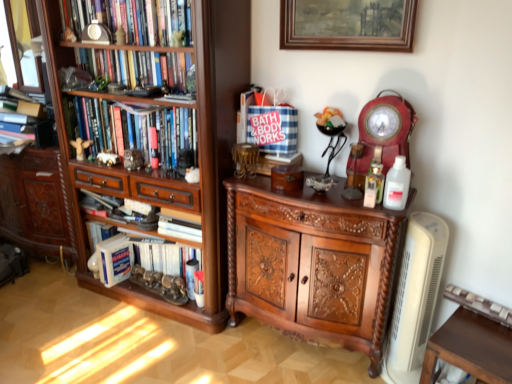
Find the location of `white plastic bottle at right`. white plastic bottle at right is located at coordinates pos(397,185).

Describe the element at coordinates (108, 158) in the screenshot. I see `gold metallic toy car at left, marked as the second toy in a left-to-right arrangement` at that location.

Describe the element at coordinates (20, 44) in the screenshot. I see `transparent glass door at upper left` at that location.

Looking at this image, in order to face matte white clock at upper left, which is the 4th book in bottom-to-top order, should I rotate leftwards or rightwards?

To face it directly, rotate left by 15.311 degrees.

In order to click on brown wooden table at lower right in this screenshot , I will do `click(471, 348)`.

I want to click on white plastic bottle at right, so click(397, 185).

Is matte white clock at upper left, marked as the 1th book in a top-to-bottom arrangement, oriented towards transparent glass door at upper left?

No, matte white clock at upper left, marked as the 1th book in a top-to-bottom arrangement, does not turn towards transparent glass door at upper left.

Considering the sizes of objects matte white clock at upper left, marked as the 1th book in a top-to-bottom arrangement, and transparent glass door at upper left in the image provided, who is bigger, matte white clock at upper left, marked as the 1th book in a top-to-bottom arrangement, or transparent glass door at upper left?

matte white clock at upper left, marked as the 1th book in a top-to-bottom arrangement, is bigger.

This screenshot has width=512, height=384. What are the coordinates of `glass door located on the left of matte white clock at upper left, which is the 4th book in bottom-to-top order` in the screenshot? It's located at (20, 44).

Is matte white clock at upper left, which is the 4th book in bottom-to-top order, situated inside transparent glass door at upper left or outside?

matte white clock at upper left, which is the 4th book in bottom-to-top order, is outside transparent glass door at upper left.

From a real-world perspective, which is physically above, white plastic bottle at right or polished wood cabinet at center?

white plastic bottle at right.

Looking at this image, between white plastic bottle at right and polished wood cabinet at center, which one has more height?

polished wood cabinet at center is taller.

Would you say white plastic bottle at right is a long distance from polished wood cabinet at center?

They are positioned close to each other.

Is white plastic bottle at right oriented towards polished wood cabinet at center?

No, white plastic bottle at right is not oriented towards polished wood cabinet at center.

Does brown wooden table at lower right have a larger size compared to hardcover book at lower left?

Yes.

Can you confirm if brown wooden table at lower right is wider than hardcover book at lower left?

Correct, the width of brown wooden table at lower right exceeds that of hardcover book at lower left.

Between brown wooden table at lower right and hardcover book at lower left, which one appears on the right side from the viewer's perspective?

Positioned to the right is brown wooden table at lower right.

Relative to hardcover book at lower left, is brown wooden table at lower right in front or behind?

brown wooden table at lower right is in front of hardcover book at lower left.

From the image's perspective, is wooden bookshelf at left beneath brown wooden table at lower right?

Incorrect, from the image's perspective, wooden bookshelf at left is higher than brown wooden table at lower right.

Is wooden bookshelf at left aimed at brown wooden table at lower right?

No.

Is point (71, 179) closer or farther from the camera than point (488, 345)?

Point (71, 179) is farther from the camera than point (488, 345).

Can you confirm if transparent glass door at upper left is positioned to the right of hardcover books at left, which is counted as the second book, starting from the bottom?

No.

Does transparent glass door at upper left have a lesser width compared to hardcover books at left, which is counted as the second book, starting from the bottom?

Yes.

From the picture: Does transparent glass door at upper left have a larger size compared to hardcover books at left, which ranks as the 3th book in top-to-bottom order?

No.

Is matte gold angel at left, the 1th toy viewed from the left, positioned in front of hardcover book at lower left, the 1th book ordered from the bottom?

No, it is not.

Can hardcover book at lower left, the 1th book ordered from the bottom, be found inside matte gold angel at left, the 1th toy viewed from the left?

No, hardcover book at lower left, the 1th book ordered from the bottom, is not inside matte gold angel at left, the 1th toy viewed from the left.

From a real-world perspective, between matte gold angel at left, the 1th toy viewed from the left, and hardcover book at lower left, the fourth book viewed from the top, who is vertically lower?

hardcover book at lower left, the fourth book viewed from the top, from a real-world perspective.

Would you say matte gold angel at left, the 1th toy viewed from the left, is to the left or to the right of hardcover book at lower left, the fourth book viewed from the top, in the picture?

From the image, it's evident that matte gold angel at left, the 1th toy viewed from the left, is to the left of hardcover book at lower left, the fourth book viewed from the top.

In the scene shown: From the image's perspective, which is above, brown wooden table at lower right or gold metallic toy car at left, the 1th toy when ordered from right to left?

gold metallic toy car at left, the 1th toy when ordered from right to left.

Based on their sizes in the image, would you say brown wooden table at lower right is bigger or smaller than gold metallic toy car at left, the 1th toy when ordered from right to left?

Considering their sizes, brown wooden table at lower right takes up more space than gold metallic toy car at left, the 1th toy when ordered from right to left.

Considering the sizes of brown wooden table at lower right and gold metallic toy car at left, the 1th toy when ordered from right to left, in the image, is brown wooden table at lower right wider or thinner than gold metallic toy car at left, the 1th toy when ordered from right to left,?

In the image, brown wooden table at lower right appears to be wider than gold metallic toy car at left, the 1th toy when ordered from right to left.

Are brown wooden table at lower right and gold metallic toy car at left, marked as the second toy in a left-to-right arrangement, making contact?

No, brown wooden table at lower right is not next to gold metallic toy car at left, marked as the second toy in a left-to-right arrangement.

The height and width of the screenshot is (384, 512). There is a transparent glass door at upper left. Find the location of `the 1st book below it (from the image's perspective)`. the 1st book below it (from the image's perspective) is located at coordinates (133, 19).

Where is `the chest of drawers that appears behind the white plastic bottle at right`? the chest of drawers that appears behind the white plastic bottle at right is located at coordinates (312, 263).

Based on their spatial positions, is hardcover book at lower left or wooden picture frame at upper center further from matte white clock at upper left, marked as the 1th book in a top-to-bottom arrangement?

hardcover book at lower left is positioned further to the anchor matte white clock at upper left, marked as the 1th book in a top-to-bottom arrangement.

Looking at the image, which one is located further to wooden carved cabinet at left, white plastic bottle at right or matte white clock at upper left, marked as the 1th book in a top-to-bottom arrangement?

white plastic bottle at right is further to wooden carved cabinet at left.

From the picture: Looking at the image, which one is located further to gold metallic toy car at left, marked as the second toy in a left-to-right arrangement, hardcover book at lower left or wooden picture frame at upper center?

The object further to gold metallic toy car at left, marked as the second toy in a left-to-right arrangement, is wooden picture frame at upper center.

When comparing their distances from wooden carved cabinet at left, does wooden picture frame at upper center or hardcover books at left, which is counted as the second book, starting from the bottom, seem closer?

hardcover books at left, which is counted as the second book, starting from the bottom, lies closer to wooden carved cabinet at left than the other object.

Considering their positions, is white plastic bottle at right positioned further to hardcover books at left, which is counted as the second book, starting from the bottom, than transparent glass door at upper left?

white plastic bottle at right is positioned further to the anchor hardcover books at left, which is counted as the second book, starting from the bottom.

Estimate the real-world distances between objects in this image. Which object is closer to white plastic bottle at right, matte white clock at upper left, which is the 4th book in bottom-to-top order, or matte gold angel at left, marked as the 2th toy in a right-to-left arrangement?

matte white clock at upper left, which is the 4th book in bottom-to-top order, is closer to white plastic bottle at right.

From the image, which object appears to be nearer to matte gold angel at left, marked as the 2th toy in a right-to-left arrangement, white plastic bottle at right or hardcover books at left, which is counted as the second book, starting from the bottom?

hardcover books at left, which is counted as the second book, starting from the bottom, is closer to matte gold angel at left, marked as the 2th toy in a right-to-left arrangement.

Based on their spatial positions, is wooden carved cabinet at left or hardcover books at left, which is counted as the second book, starting from the bottom, closer to matte white clock at upper left, marked as the 1th book in a top-to-bottom arrangement?

hardcover books at left, which is counted as the second book, starting from the bottom, is closer to matte white clock at upper left, marked as the 1th book in a top-to-bottom arrangement.

You are a GUI agent. You are given a task and a screenshot of the screen. Output one action in this format:
    pyautogui.click(x=<x>, y=<y>)
    Task: Click on the glass door situated between wooden carved cabinet at left and white plastic bottle at right from left to right
    The width and height of the screenshot is (512, 384).
    Given the screenshot: What is the action you would take?
    20,44

This screenshot has width=512, height=384. I want to click on toy between matte gold angel at left, the 1th toy viewed from the left, and brown wooden table at lower right, so coord(108,158).

I want to click on bottle situated between hardcover book at lower left and brown wooden table at lower right from left to right, so click(397, 185).

Identify the location of shelf between hardcover books at left, which is counted as the second book, starting from the bottom, and wooden picture frame at upper center, in the horizontal direction. This screenshot has height=384, width=512. (166, 170).